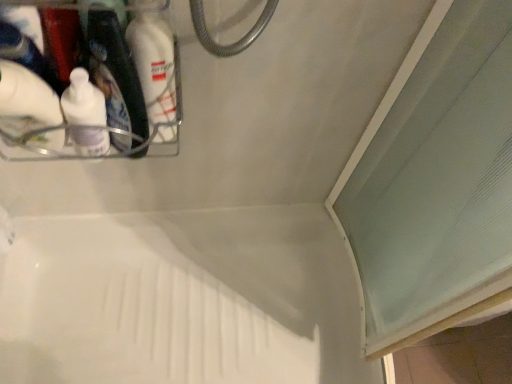
Question: Which is correct: white matte bottle at upper left is inside white plastic bath at center, or outside of it?

Choices:
 (A) inside
 (B) outside

Answer: (B)

Question: Is white matte bottle at upper left to the left or to the right of white plastic bath at center in the image?

Choices:
 (A) right
 (B) left

Answer: (B)

Question: Which object is positioned closest to the white plastic bath at center?

Choices:
 (A) white matte bottle at upper left
 (B) white matte bottle at upper left

Answer: (A)

Question: Considering the real-world distances, which object is farthest from the white matte bottle at upper left?

Choices:
 (A) white plastic bath at center
 (B) white matte bottle at upper left

Answer: (A)